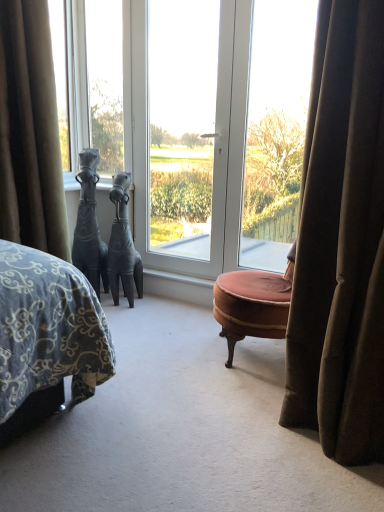
In the scene shown: What is the approximate width of white glossy door at center, which ranks as the 2th window in right-to-left order?

white glossy door at center, which ranks as the 2th window in right-to-left order, is 1.91 inches wide.

In order to face white glossy door at center, which ranks as the 2th window in right-to-left order, should I rotate leftwards or rightwards?

You should rotate right by 3.560 degrees.

You are a GUI agent. You are given a task and a screenshot of the screen. Output one action in this format:
    pyautogui.click(x=<x>, y=<y>)
    Task: Click on the matte black sculpture at center, placed as the 1th sculpture when sorted from right to left
    The height and width of the screenshot is (512, 384).
    Given the screenshot: What is the action you would take?
    tap(123, 246)

What is the approximate height of transparent glass screen door at center?

transparent glass screen door at center is 6.07 feet in height.

Describe the element at coordinates (253, 304) in the screenshot. This screenshot has width=384, height=512. I see `velvet brown ottoman at center` at that location.

What is the approximate height of black matte horse at left, acting as the second sculpture starting from the right?

black matte horse at left, acting as the second sculpture starting from the right, is 1.05 meters in height.

Describe the element at coordinates (30, 132) in the screenshot. The height and width of the screenshot is (512, 384). I see `brown velvet curtain at left` at that location.

The image size is (384, 512). I want to click on clear glass window at center, the first window viewed from the right, so click(x=276, y=129).

Find the location of a particular element. white glossy door at center, which ranks as the 2th window in right-to-left order is located at coordinates (196, 123).

Would you say brown velvet curtain at left is a long distance from black matte horse at left, acting as the second sculpture starting from the right?

Actually, brown velvet curtain at left and black matte horse at left, acting as the second sculpture starting from the right, are a little close together.

This screenshot has height=512, width=384. In order to click on the 1st sculpture to the right when counting from the brown velvet curtain at left in this screenshot , I will do `click(89, 225)`.

From the image's perspective, is brown velvet curtain at left above or below black matte horse at left, acting as the second sculpture starting from the right?

Clearly, from the image's perspective, brown velvet curtain at left is above black matte horse at left, acting as the second sculpture starting from the right.

From their relative heights in the image, would you say velvet brown ottoman at center is taller or shorter than brown velvet curtain at left?

In the image, velvet brown ottoman at center appears to be shorter than brown velvet curtain at left.

This screenshot has height=512, width=384. I want to click on chair behind the brown velvet curtain at left, so click(x=253, y=304).

Can you tell me how much velvet brown ottoman at center and brown velvet curtain at left differ in facing direction?

59.6 degrees.

Is velvet brown ottoman at center in front of brown velvet curtain at left?

No, the depth of velvet brown ottoman at center is greater than that of brown velvet curtain at left.

Which object is further away from the camera, clear glass window at center, the first window viewed from the right, or brown velvet curtain at left?

clear glass window at center, the first window viewed from the right, is further away from the camera.

In the scene shown: How many degrees apart are the facing directions of clear glass window at center, the first window viewed from the right, and brown velvet curtain at left?

They differ by 0.104 degrees in their facing directions.

Is clear glass window at center, positioned as the 3th window in left-to-right order, beside brown velvet curtain at left?

No, clear glass window at center, positioned as the 3th window in left-to-right order, is not with brown velvet curtain at left.

Is clear glass window at center, the first window viewed from the right, to the left of brown velvet curtain at left from the viewer's perspective?

Incorrect, clear glass window at center, the first window viewed from the right, is not on the left side of brown velvet curtain at left.

Is transparent glass screen door at center behind matte black sculpture at center, the 2th sculpture viewed from the left?

No, transparent glass screen door at center is in front of matte black sculpture at center, the 2th sculpture viewed from the left.

Is transparent glass screen door at center surrounding matte black sculpture at center, the 2th sculpture viewed from the left?

That's incorrect, matte black sculpture at center, the 2th sculpture viewed from the left, is not inside transparent glass screen door at center.

Between transparent glass screen door at center and matte black sculpture at center, placed as the 1th sculpture when sorted from right to left, which one has smaller size?

With smaller size is matte black sculpture at center, placed as the 1th sculpture when sorted from right to left.

Based on the photo, is black matte horse at left, acting as the second sculpture starting from the right, looking in the opposite direction of transparent glass screen door at center?

No, black matte horse at left, acting as the second sculpture starting from the right, is not facing away from transparent glass screen door at center.

Which of these two, black matte horse at left, the 1th sculpture from the left, or transparent glass screen door at center, is bigger?

transparent glass screen door at center.

From a real-world perspective, which object rests below the other?

black matte horse at left, the 1th sculpture from the left, is physically lower.

The width and height of the screenshot is (384, 512). What are the coordinates of `the 1st sculpture behind the transparent glass screen door at center, starting your count from the anchor` in the screenshot? It's located at (89, 225).

Do you think brown velvet curtain at left is within clear glass window at center, the first window viewed from the right, or outside of it?

brown velvet curtain at left is outside clear glass window at center, the first window viewed from the right.

What's the angular difference between brown velvet curtain at left and clear glass window at center, the first window viewed from the right,'s facing directions?

The angular difference between brown velvet curtain at left and clear glass window at center, the first window viewed from the right, is 0.104 degrees.

Can you confirm if brown velvet curtain at left is shorter than clear glass window at center, the first window viewed from the right?

Correct, brown velvet curtain at left is not as tall as clear glass window at center, the first window viewed from the right.

From the image's perspective, does brown velvet curtain at left appear higher than clear glass window at center, positioned as the 3th window in left-to-right order?

No.

In the scene shown: Is velvet brown ottoman at center inside the boundaries of clear glass window at center, the first window viewed from the right, or outside?

velvet brown ottoman at center is not enclosed by clear glass window at center, the first window viewed from the right.

Is velvet brown ottoman at center with clear glass window at center, positioned as the 3th window in left-to-right order?

No, velvet brown ottoman at center is not making contact with clear glass window at center, positioned as the 3th window in left-to-right order.

From the image's perspective, is velvet brown ottoman at center below clear glass window at center, positioned as the 3th window in left-to-right order?

Yes, from the image's perspective, velvet brown ottoman at center is beneath clear glass window at center, positioned as the 3th window in left-to-right order.

Could you tell me if velvet brown ottoman at center is facing clear glass window at center, the first window viewed from the right?

No, velvet brown ottoman at center is not facing towards clear glass window at center, the first window viewed from the right.

This screenshot has height=512, width=384. I want to click on the 1st sculpture to the right of the brown velvet curtain at left, starting your count from the anchor, so click(89, 225).

Locate an element on the screen. chair that is under the brown velvet curtain at left (from a real-world perspective) is located at coordinates (253, 304).

Consider the image. When comparing their distances from matte black sculpture at center, the 2th sculpture viewed from the left, does clear glass window at center, which ranks as the first window in left-to-right order, or brown velvet curtain at left seem closer?

clear glass window at center, which ranks as the first window in left-to-right order.

Estimate the real-world distances between objects in this image. Which object is closer to matte black sculpture at center, the 2th sculpture viewed from the left, black matte horse at left, acting as the second sculpture starting from the right, or transparent glass screen door at center?

black matte horse at left, acting as the second sculpture starting from the right, is closer to matte black sculpture at center, the 2th sculpture viewed from the left.

Looking at the image, which one is located closer to brown velvet curtain at left, black matte horse at left, acting as the second sculpture starting from the right, or matte black sculpture at center, the 2th sculpture viewed from the left?

black matte horse at left, acting as the second sculpture starting from the right, is positioned closer to the anchor brown velvet curtain at left.

Based on their spatial positions, is black matte horse at left, the 1th sculpture from the left, or clear glass window at center, arranged as the third window when viewed from the right, closer to clear glass window at center, the first window viewed from the right?

Based on the image, clear glass window at center, arranged as the third window when viewed from the right, appears to be nearer to clear glass window at center, the first window viewed from the right.

Based on their spatial positions, is clear glass window at center, the first window viewed from the right, or transparent glass screen door at center closer to white glossy door at center, which ranks as the 2th window in right-to-left order?

transparent glass screen door at center is closer to white glossy door at center, which ranks as the 2th window in right-to-left order.

From the image, which object appears to be nearer to velvet brown ottoman at center, clear glass window at center, which ranks as the first window in left-to-right order, or black matte horse at left, acting as the second sculpture starting from the right?

Among the two, black matte horse at left, acting as the second sculpture starting from the right, is located nearer to velvet brown ottoman at center.

Considering their positions, is clear glass window at center, positioned as the 3th window in left-to-right order, positioned closer to clear glass window at center, which ranks as the first window in left-to-right order, than white glossy door at center, the 2th window viewed from the left?

The object closer to clear glass window at center, which ranks as the first window in left-to-right order, is white glossy door at center, the 2th window viewed from the left.

Looking at this image, looking at the image, which one is located further to matte black sculpture at center, placed as the 1th sculpture when sorted from right to left, brown velvet curtain at left or white glossy door at center, the 2th window viewed from the left?

Based on the image, brown velvet curtain at left appears to be further to matte black sculpture at center, placed as the 1th sculpture when sorted from right to left.

The height and width of the screenshot is (512, 384). What are the coordinates of `screen door between clear glass window at center, arranged as the third window when viewed from the right, and matte black sculpture at center, placed as the 1th sculpture when sorted from right to left, vertically` in the screenshot? It's located at (187, 128).

Identify the location of screen door between black matte horse at left, the 1th sculpture from the left, and velvet brown ottoman at center. Image resolution: width=384 pixels, height=512 pixels. (187, 128).

What are the coordinates of `screen door between brown velvet curtain at left and black matte horse at left, the 1th sculpture from the left, along the z-axis` in the screenshot? It's located at (187, 128).

I want to click on sculpture between black matte horse at left, the 1th sculpture from the left, and velvet brown ottoman at center, in the horizontal direction, so click(x=123, y=246).